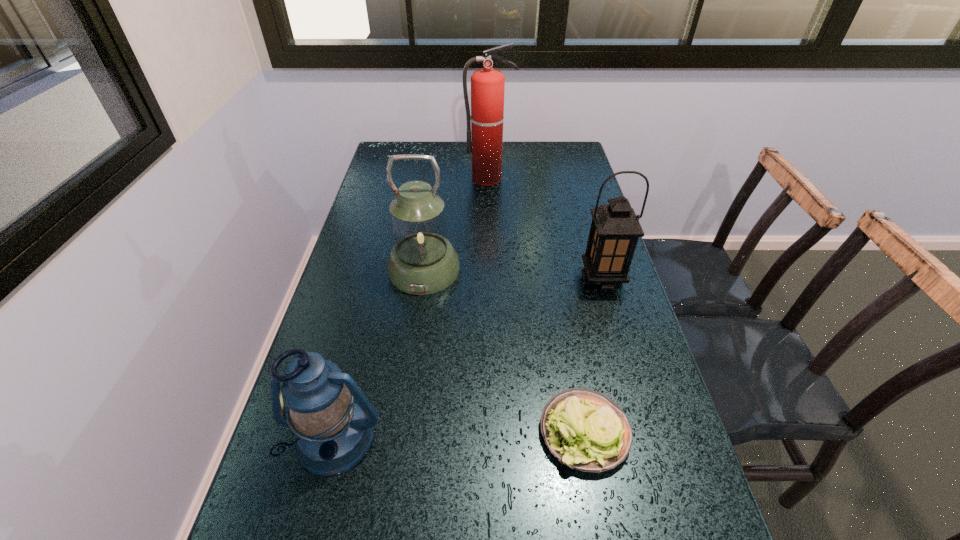
This screenshot has width=960, height=540. Identify the location of fire extinguisher. (485, 128).

This screenshot has width=960, height=540. Identify the location of the farthest object. (485, 128).

You are a GUI agent. You are given a task and a screenshot of the screen. Output one action in this format:
    pyautogui.click(x=<x>, y=<y>)
    Task: Click on the rightmost lantern
    
    Given the screenshot: What is the action you would take?
    pyautogui.click(x=614, y=232)

Locate an element on the screen. Image resolution: width=960 pixels, height=540 pixels. the fourth tallest object is located at coordinates (334, 434).

Locate an element on the screen. This screenshot has width=960, height=540. the nearest lantern is located at coordinates (334, 434).

This screenshot has width=960, height=540. What are the coordinates of `lettuce` in the screenshot? It's located at (586, 430).

Locate an element on the screen. This screenshot has width=960, height=540. free space located 0.050m with the nozzle and gauge on the third object from left to right is located at coordinates (489, 193).

I want to click on vacant area situated 0.180m on the left of the rightmost lantern, so click(515, 279).

The width and height of the screenshot is (960, 540). What are the coordinates of `vacant space situated on the left of the lettuce` in the screenshot? It's located at (373, 431).

Locate an element on the screen. Image resolution: width=960 pixels, height=540 pixels. object that is at the far edge is located at coordinates (485, 128).